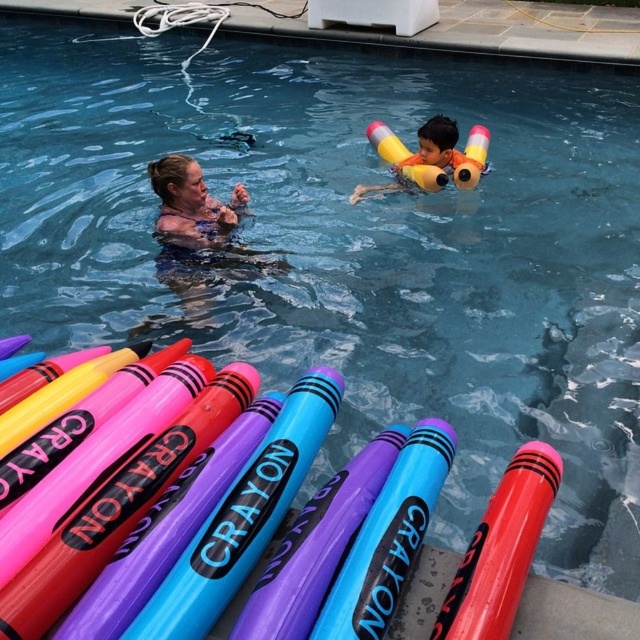
Between yellow foam floaties at upper center and matte skin at center, which one has less height?

Standing shorter between the two is matte skin at center.

Is yellow foam floaties at upper center to the left of matte skin at center from the viewer's perspective?

No, yellow foam floaties at upper center is not to the left of matte skin at center.

Between point (461, 166) and point (237, 198), which one is positioned behind?

The point (461, 166) is more distant.

Locate an element on the screen. The height and width of the screenshot is (640, 640). yellow foam floaties at upper center is located at coordinates (428, 157).